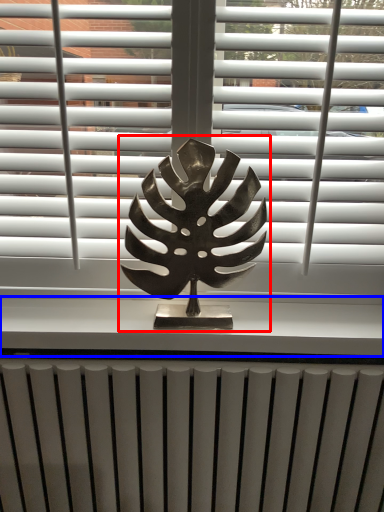
Question: Which of the following is the closest to the observer, bronze statue (highlighted by a red box) or window sill (highlighted by a blue box)?

Choices:
 (A) bronze statue
 (B) window sill

Answer: (A)